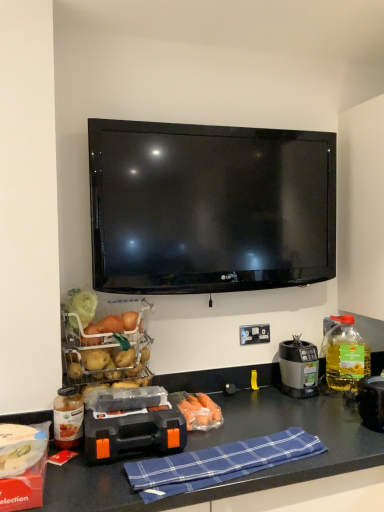
Locate an element on the screen. This screenshot has height=512, width=384. free space above orange plastic toolbox at center (from a real-world perspective) is located at coordinates coord(144,411).